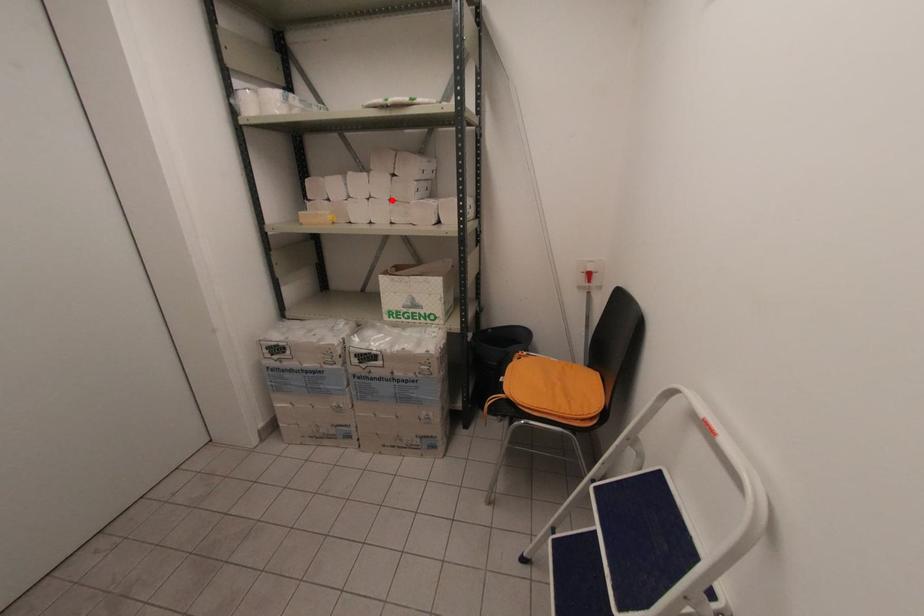
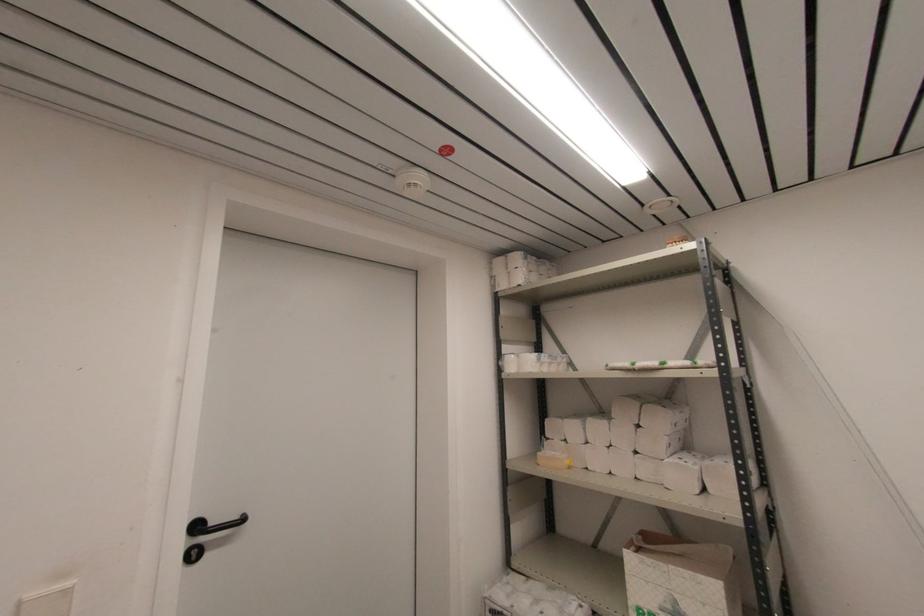
The point at the highlighted location is marked in the first image. Where is the corresponding point in the second image?

(637, 453)